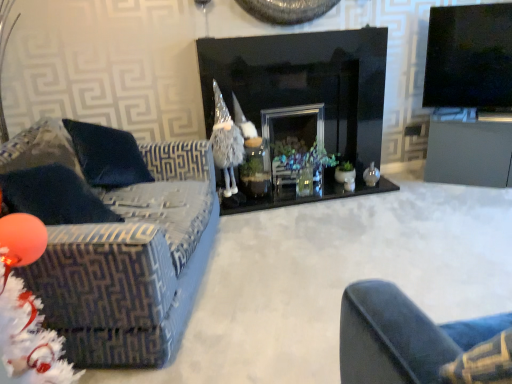
Locate an element on the screen. vacant area that lies in front of matte gray table at right is located at coordinates (472, 202).